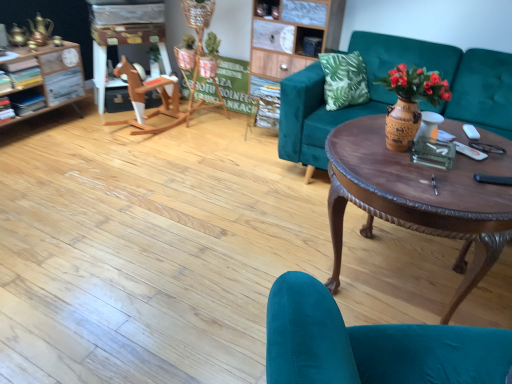
You are a GUI agent. You are given a task and a screenshot of the screen. Output one action in this format:
    pyautogui.click(x=<x>, y=<y>)
    Task: Click on the spots to the right of wooden rocking horse at left
    This screenshot has width=512, height=384.
    Given the screenshot: What is the action you would take?
    pyautogui.click(x=205, y=140)